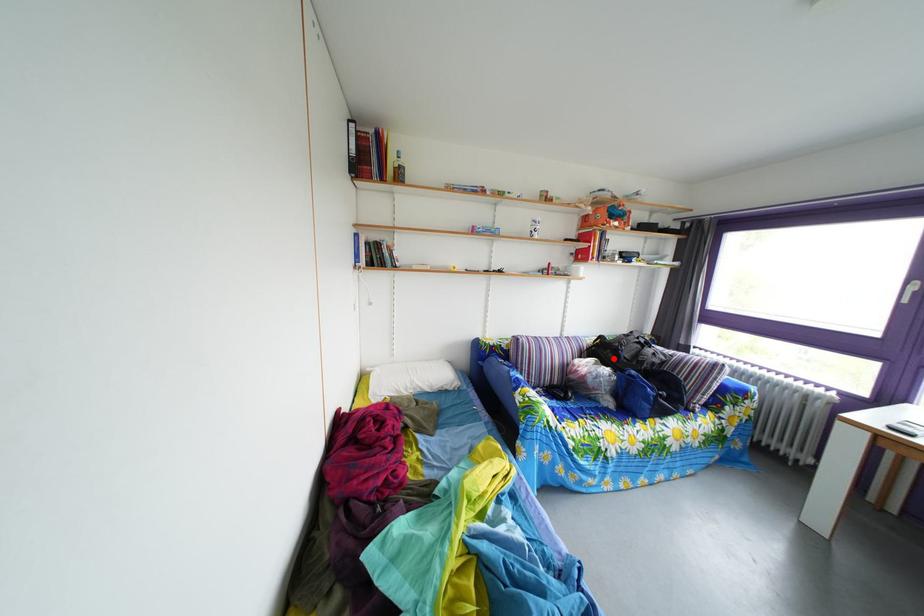
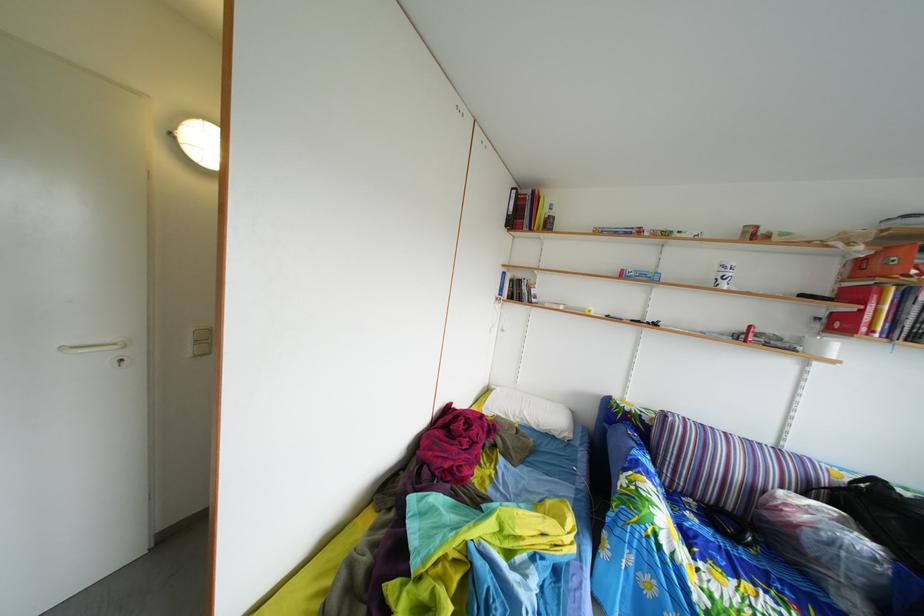
In the second image, find the point that corresponds to the highlighted location in the first image.

(886, 515)